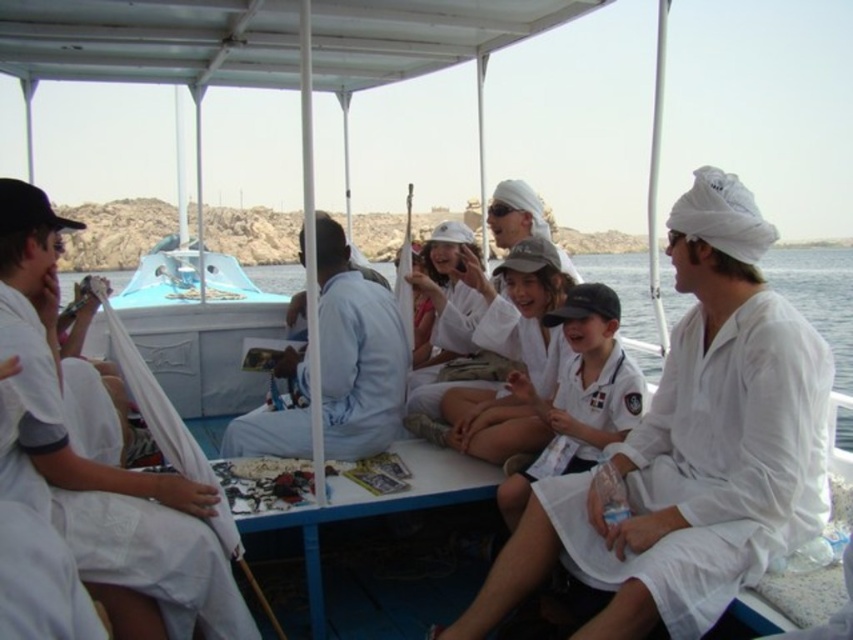
Question: Considering the relative positions of white cotton robe at left and white cotton robe at center in the image provided, where is white cotton robe at left located with respect to white cotton robe at center?

Choices:
 (A) left
 (B) right

Answer: (A)

Question: Where is light blue fabric at center located in relation to white cotton robe at center in the image?

Choices:
 (A) below
 (B) above

Answer: (B)

Question: Is the position of white cotton robe at right less distant than that of white cotton robe at left?

Choices:
 (A) no
 (B) yes

Answer: (B)

Question: Considering the real-world distances, which object is farthest from the white cotton robe at right?

Choices:
 (A) white cotton robe at left
 (B) white cotton robe at center
 (C) light blue fabric at center

Answer: (A)

Question: Which object is closer to the camera taking this photo?

Choices:
 (A) white cotton robe at right
 (B) white cotton robe at center

Answer: (A)

Question: Estimate the real-world distances between objects in this image. Which object is closer to the white cotton robe at center?

Choices:
 (A) white cotton robe at right
 (B) light blue fabric at center
 (C) white cotton robe at left

Answer: (A)